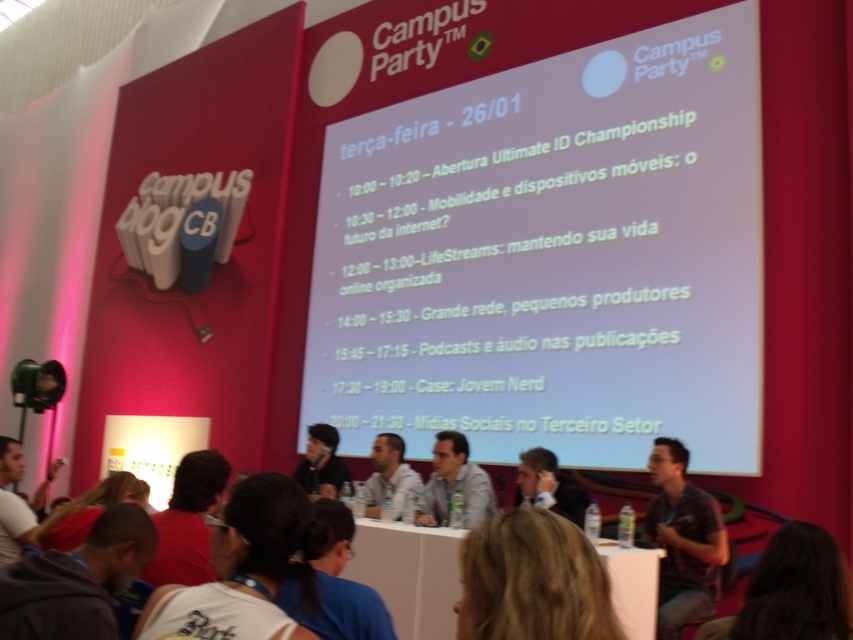
You are an attendee at Campus Party and want to take a photo of the panelists. You notice two panelists wearing a striped denim shirt at right and a gray fabric shirt at center. Which one is positioned closer to the front of the stage?

The striped denim shirt at right is closer to the viewer than the gray fabric shirt at center, so the panelist in the striped denim shirt at right is positioned closer to the front of the stage.

You are attending Campus Party and want to take a photo of the panelists. The dark gray hoodie at lower left and the black matte shirt at center are both in your view. Which panelist is positioned more to the left side of the stage?

The dark gray hoodie at lower left is positioned more to the left side of the stage than the black matte shirt at center.